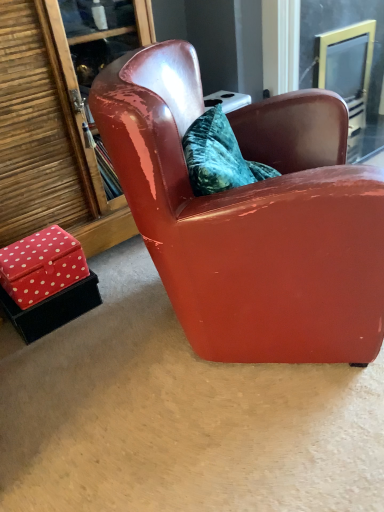
Identify the location of unoccupied region to the right of red polka dot fabric box at lower left, placed as the 2th box when sorted from top to bottom. The width and height of the screenshot is (384, 512). (120, 305).